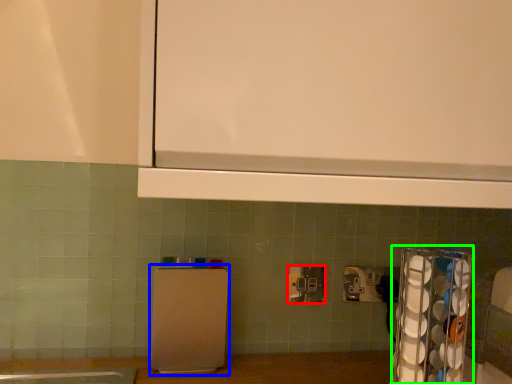
Question: Which object is positioned farthest from power plugs and sockets (highlighted by a red box)? Select from appliance (highlighted by a blue box) and appliance (highlighted by a green box).

Choices:
 (A) appliance
 (B) appliance

Answer: (B)